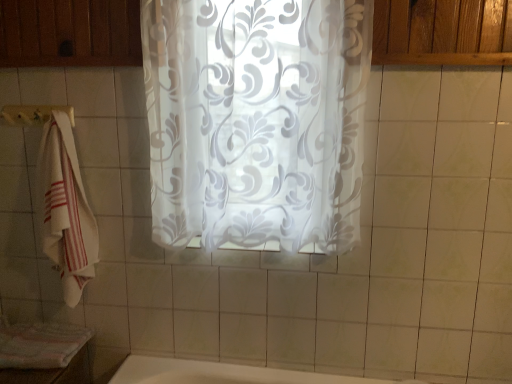
Question: From the image's perspective, is transparent floral-patterned curtain at center positioned above or below white cotton towel at left?

Choices:
 (A) below
 (B) above

Answer: (B)

Question: From their relative heights in the image, would you say transparent floral-patterned curtain at center is taller or shorter than white cotton towel at left?

Choices:
 (A) short
 (B) tall

Answer: (B)

Question: Which object is positioned farthest from the white cotton towel at left?

Choices:
 (A) striped cotton bath towel at lower left
 (B) transparent floral-patterned curtain at center
 (C) white fabric towel bar at left

Answer: (B)

Question: Which is farther from the striped cotton bath towel at lower left?

Choices:
 (A) white cotton towel at left
 (B) transparent floral-patterned curtain at center
 (C) white fabric towel bar at left

Answer: (B)